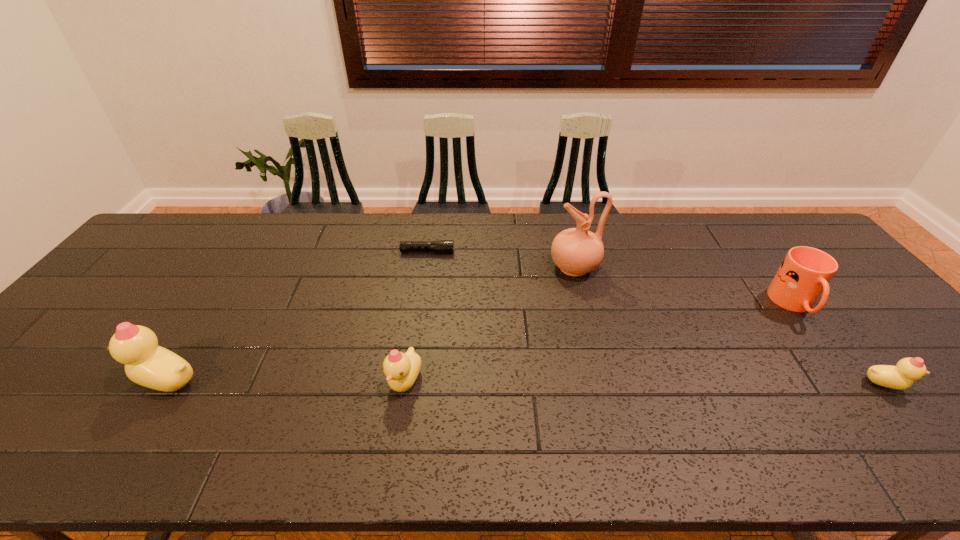
Identify the location of the fifth shortest object. This screenshot has width=960, height=540. (147, 364).

This screenshot has height=540, width=960. Find the location of `the tallest duckling`. the tallest duckling is located at coordinates click(147, 364).

Identify the location of the second tallest duckling. (402, 369).

At what (x,y) coordinates should I click in order to perform the action: click on the rightmost duckling. Please return your answer as a coordinate pair (x, y). The image size is (960, 540). Looking at the image, I should click on (902, 376).

The width and height of the screenshot is (960, 540). I want to click on the fifth tallest object, so click(x=902, y=376).

At what (x,y) coordinates should I click in order to perform the action: click on the shortest object. Please return your answer as a coordinate pair (x, y). Image resolution: width=960 pixels, height=540 pixels. Looking at the image, I should click on (440, 246).

In order to click on the fourth object from left to right in this screenshot , I will do `click(576, 251)`.

Find the location of a particular element. pottery is located at coordinates (576, 251).

Where is `the fourth nearest object`? This screenshot has height=540, width=960. the fourth nearest object is located at coordinates (805, 272).

The width and height of the screenshot is (960, 540). What are the coordinates of `free space located 0.150m on the front-facing side of the leftmost object` in the screenshot? It's located at (69, 380).